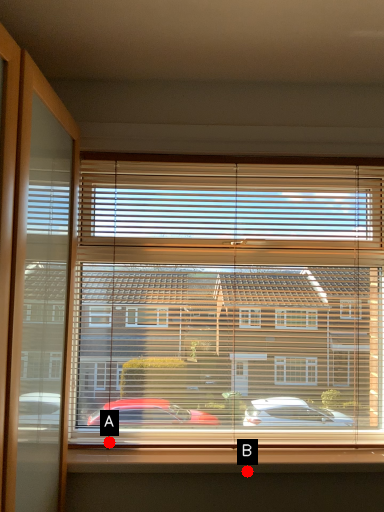
Question: Two points are circled on the image, labeled by A and B beside each circle. Which of the following is the closest to the observer?

Choices:
 (A) A is closer
 (B) B is closer

Answer: (B)